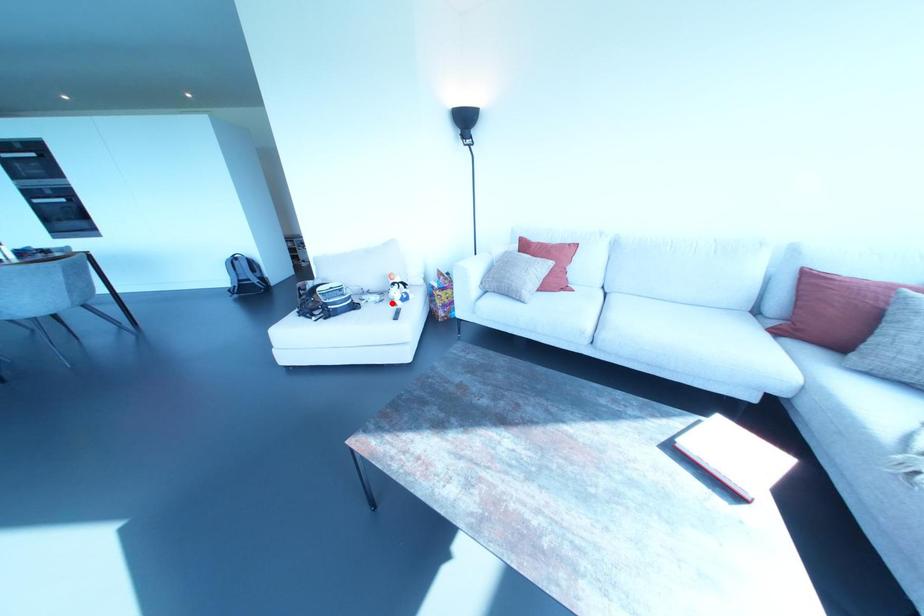
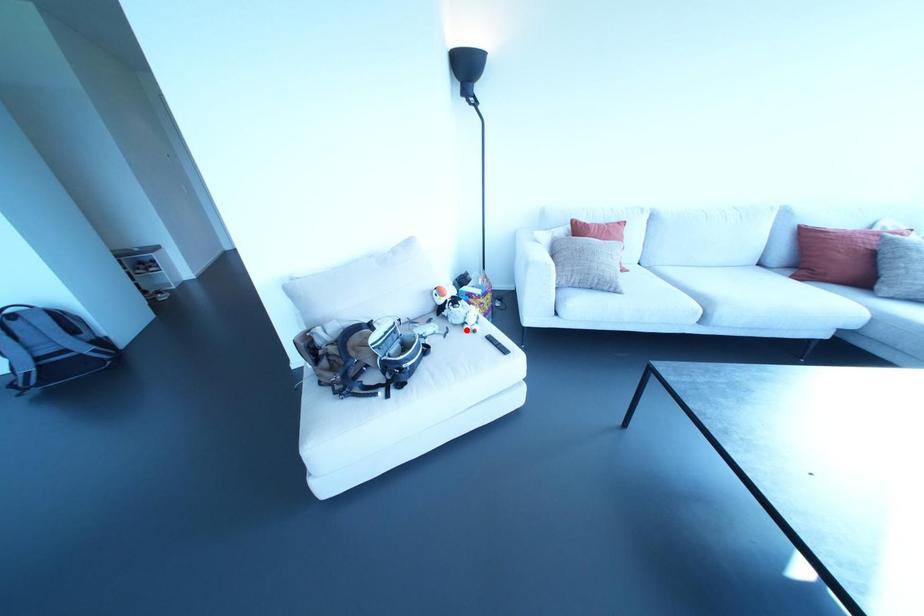
I am providing you with two images of the same scene from different viewpoints. A red point is marked on the first image and another point is marked on the second image. Is the red point in image1 aligned with the point shown in image2?

Yes